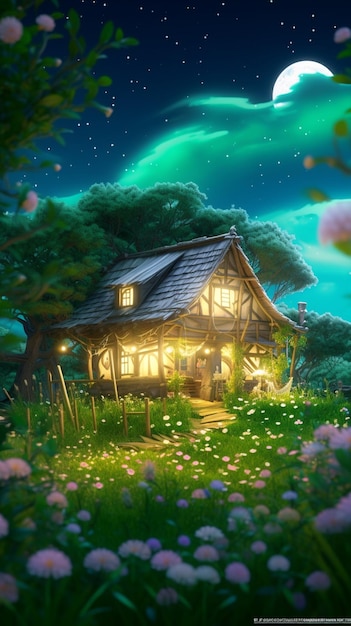
Where is `brightly lit house`? This screenshot has width=351, height=626. brightly lit house is located at coordinates (223, 310).